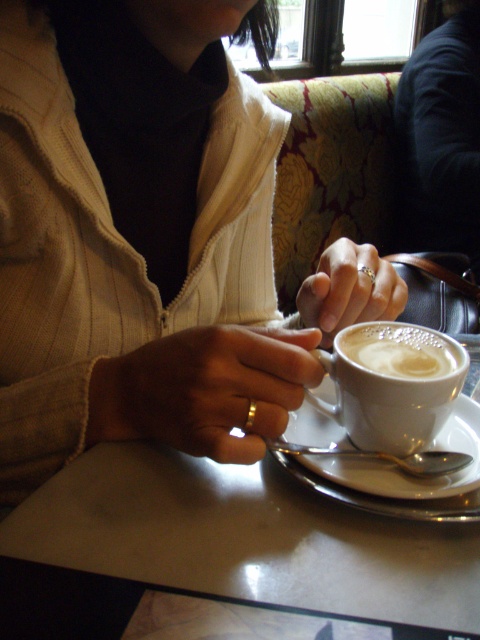
You are a barista trying to place a new coffee order on the table. The customer wants the coffee to be as close as possible to the edge of the table without falling off. Based on the scene, where should you place the white frothy coffee at center relative to the white glossy table at center?

The white frothy coffee at center should be placed behind the white glossy table at center since the table is in front of the coffee, allowing the coffee to be near the edge closest to the customer without falling off.

You are a barista trying to clean the table. You see the white matte cup at center and the white frothy coffee at center. Which object should you pick up first to avoid spilling the coffee?

You should pick up the white frothy coffee at center first because the white matte cup at center is positioned under it, meaning the coffee is likely in the cup and lifting the cup would disturb the coffee.